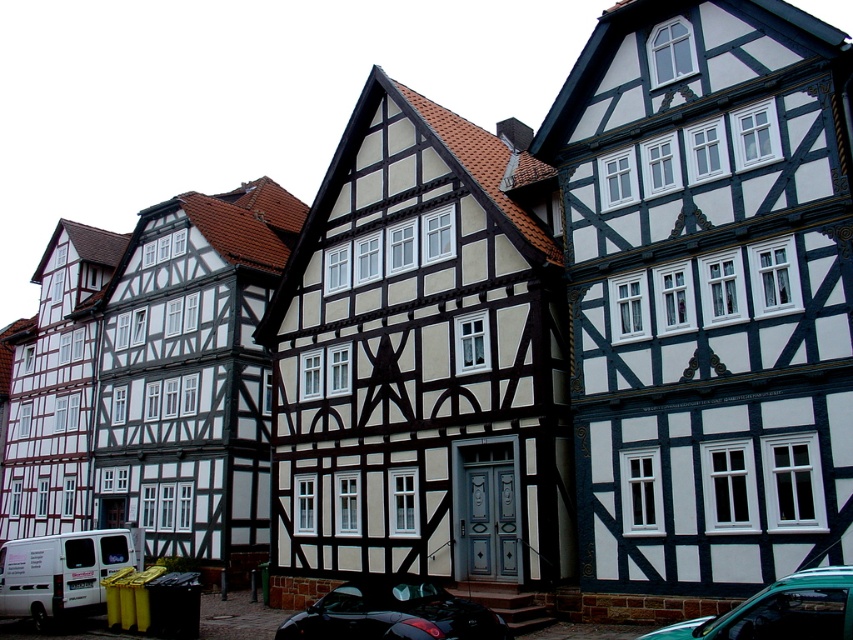
Is shiny black car at lower center behind teal matte car at lower right?

Yes, it is behind teal matte car at lower right.

Which is in front, point (380, 611) or point (831, 616)?

Point (831, 616)

Which is in front, point (421, 593) or point (811, 616)?

Point (811, 616) is in front.

The height and width of the screenshot is (640, 853). In order to click on shiny black car at lower center in this screenshot , I will do `click(393, 612)`.